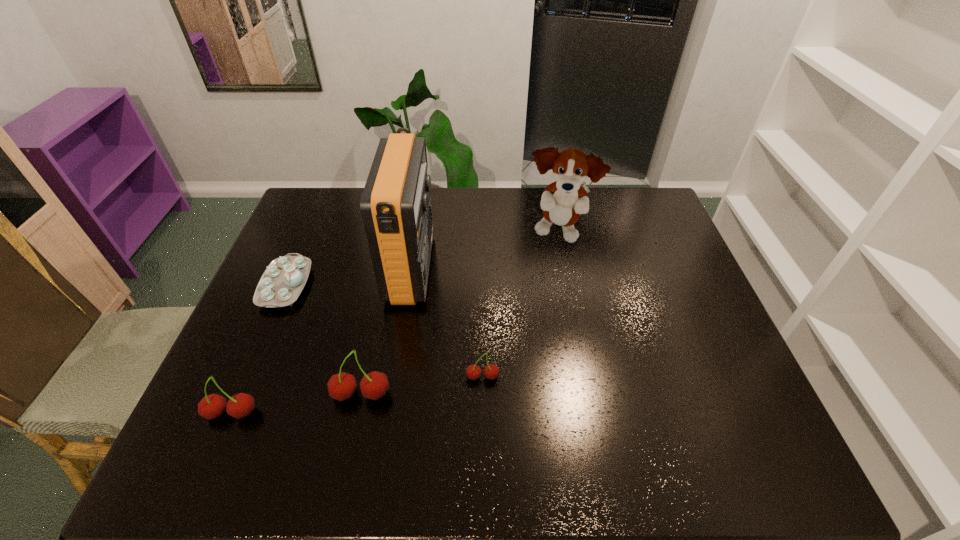
Where is `vacant area that lies between the second cherry from left to right and the puppy`? vacant area that lies between the second cherry from left to right and the puppy is located at coordinates (460, 314).

You are a GUI agent. You are given a task and a screenshot of the screen. Output one action in this format:
    pyautogui.click(x=<x>, y=<y>)
    Task: Click on the free spot between the second object from right to left and the shortest object
    This screenshot has height=540, width=960.
    Given the screenshot: What is the action you would take?
    pyautogui.click(x=384, y=331)

In order to click on object that is the closest one to the fifth shortest object in this screenshot , I will do `click(396, 210)`.

Image resolution: width=960 pixels, height=540 pixels. What are the coordinates of `object that is the fifth closest one to the radio receiver` in the screenshot? It's located at (241, 405).

Select which cherry appears as the closest to the second cherry from right to left. Please provide its 2D coordinates. Your answer should be formatted as a tuple, i.e. [(x, y)], where the tuple contains the x and y coordinates of a point satisfying the conditions above.

[(241, 405)]

Locate which cherry is the second closest to the leftmost cherry. Please provide its 2D coordinates. Your answer should be formatted as a tuple, i.e. [(x, y)], where the tuple contains the x and y coordinates of a point satisfying the conditions above.

[(491, 371)]

Find the location of a particular element. The width and height of the screenshot is (960, 540). vacant space that satisfies the following two spatial constraints: 1. on the front-facing side of the radio receiver; 2. on the surface of the fourth tallest object is located at coordinates (388, 413).

Where is `free spot that satisfies the following two spatial constraints: 1. on the front-facing side of the radio receiver; 2. on the surface of the second cherry from right to left`? This screenshot has height=540, width=960. free spot that satisfies the following two spatial constraints: 1. on the front-facing side of the radio receiver; 2. on the surface of the second cherry from right to left is located at coordinates pyautogui.click(x=392, y=394).

Where is `free space that satisfies the following two spatial constraints: 1. on the front-facing side of the radio receiver; 2. on the surface of the second tallest cherry`? The height and width of the screenshot is (540, 960). free space that satisfies the following two spatial constraints: 1. on the front-facing side of the radio receiver; 2. on the surface of the second tallest cherry is located at coordinates (388, 413).